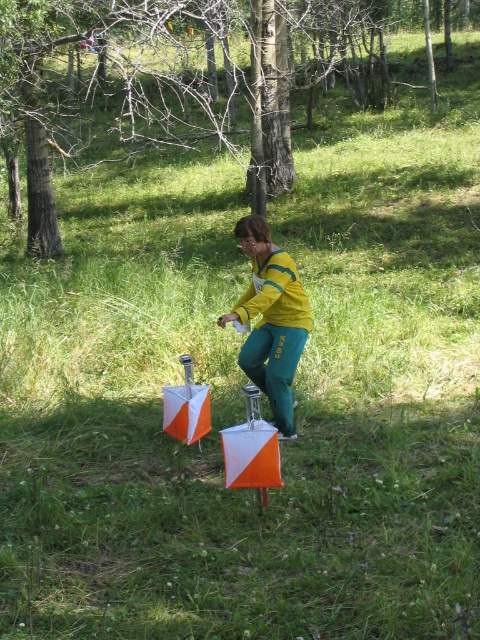
Who is higher up, brown wood tree at upper center or yellow fabric pants at center?

brown wood tree at upper center

Between point (119, 88) and point (251, 369), which one is positioned in front?

Point (251, 369) is more forward.

Who is more forward, (275, 138) or (251, 371)?

Point (251, 371) is in front.

Locate an element on the screen. The width and height of the screenshot is (480, 640). brown wood tree at upper center is located at coordinates (113, 84).